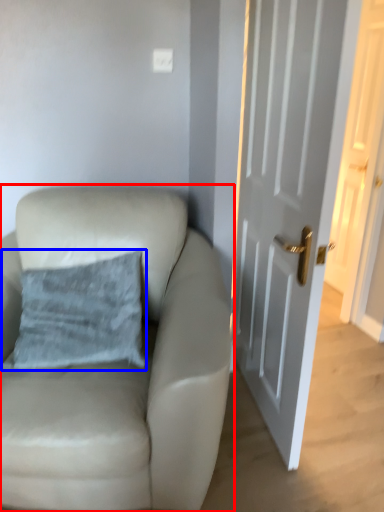
Question: Which point is closer to the camera, chair (highlighted by a red box) or pillow (highlighted by a blue box)?

Choices:
 (A) chair
 (B) pillow

Answer: (A)